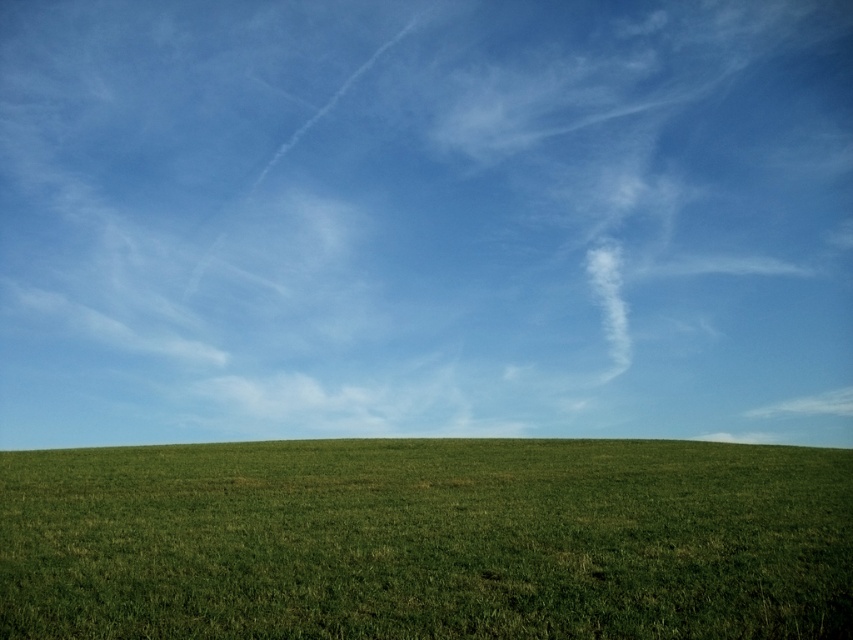
You are an airplane passenger looking out the window and see the white cotton cloud at upper center and the green grassy field at lower center. Which object appears larger from your perspective?

The white cotton cloud at upper center appears larger than the green grassy field at lower center because it is bigger in size.

Consider the image. You are standing in the middle of the field and see two points in the sky. The first point is at coordinates point (x=242, y=289) and the second point is at point (x=257, y=536). Which point is closer to you?

Point (x=257, y=536) is closer to you because it is less further to the camera than point (x=242, y=289).

You are standing in the middle of the green grass and want to take a photo of the white cotton cloud at upper center. If your camera has a maximum zoom range of 200 feet, will you be able to capture the cloud clearly?

The white cotton cloud at upper center and the camera are 201.52 feet apart, which exceeds the camera maximum zoom range of 200 feet. Therefore, you cannot capture the cloud clearly.